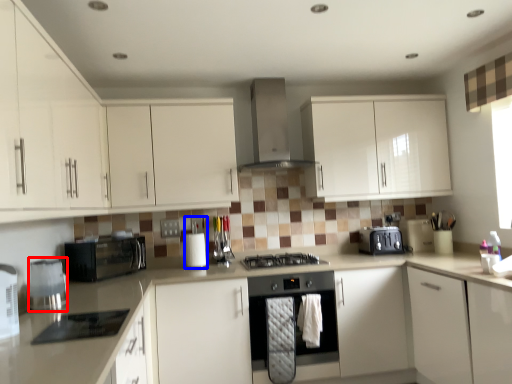
Question: Which object appears farthest to the camera in this image, kitchen appliance (highlighted by a red box) or appliance (highlighted by a blue box)?

Choices:
 (A) kitchen appliance
 (B) appliance

Answer: (B)